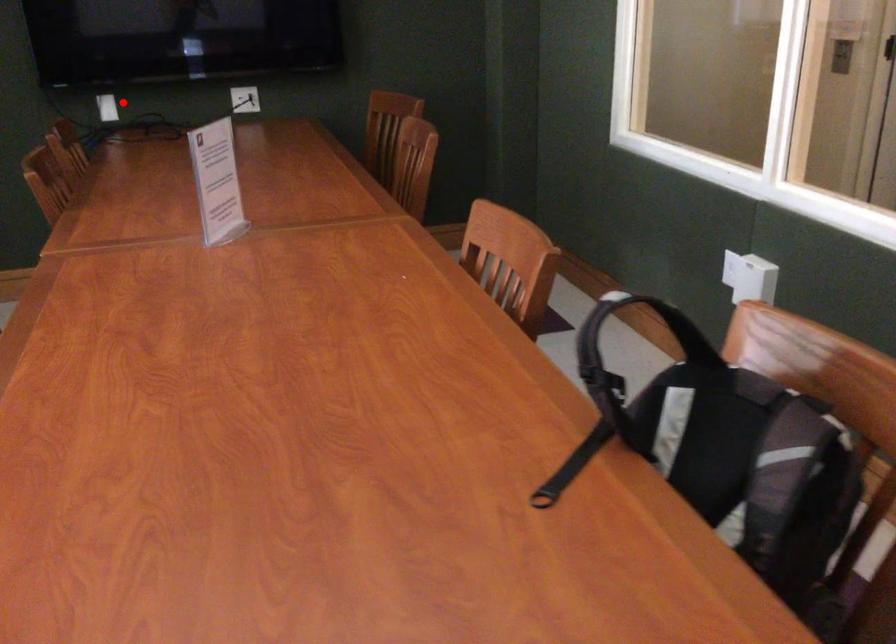
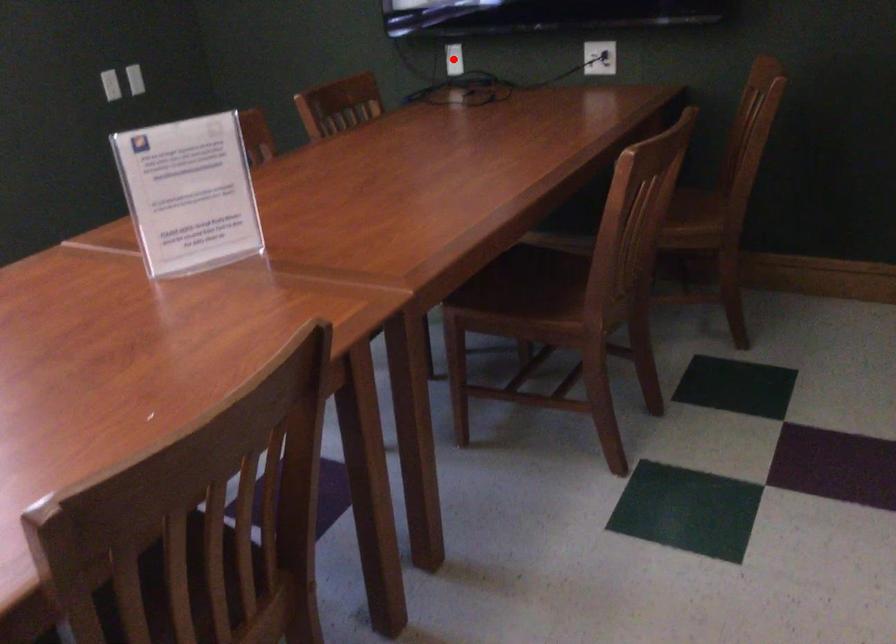
I am providing you with two images of the same scene from different viewpoints. A red point is marked on the first image and another point is marked on the second image. Is the red point in image1 aligned with the point shown in image2?

Yes